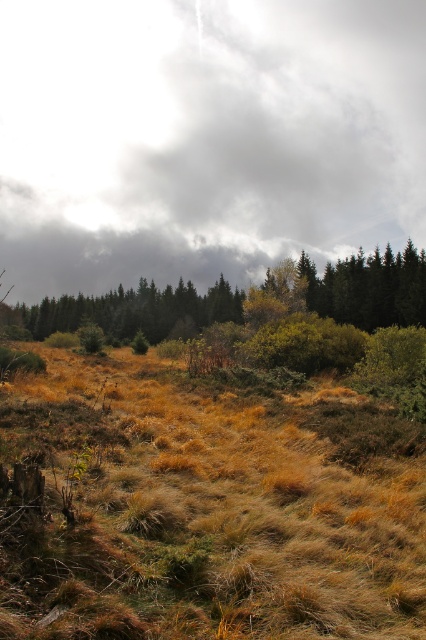
Can you confirm if dry grass at center is positioned to the right of green matte tree at center?

Correct, you'll find dry grass at center to the right of green matte tree at center.

Locate an element on the screen. dry grass at center is located at coordinates (204, 508).

Does point (103, 72) come closer to viewer compared to point (371, 588)?

No, it is not.

You are a GUI agent. You are given a task and a screenshot of the screen. Output one action in this format:
    pyautogui.click(x=<x>, y=<y>)
    Task: Click on the cloudy sky at upper center
    The width and height of the screenshot is (426, 640).
    Given the screenshot: What is the action you would take?
    pyautogui.click(x=204, y=136)

Who is more forward, (204,243) or (92,301)?

Positioned in front is point (92,301).

Is point (399, 86) closer to camera compared to point (109, 304)?

No.

Identify the location of cloudy sky at upper center. Image resolution: width=426 pixels, height=640 pixels. (204, 136).